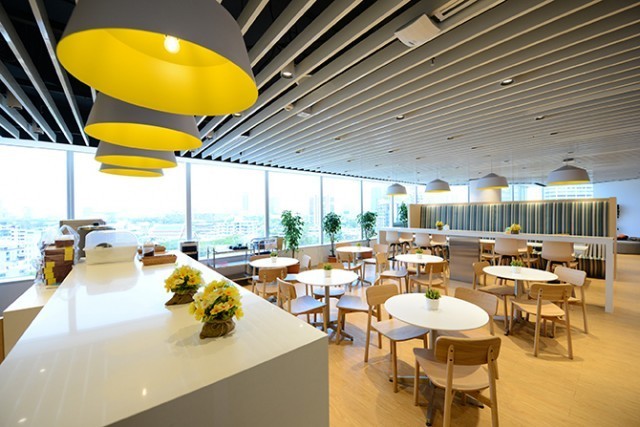
Locate an element on the screen. Image resolution: width=640 pixels, height=427 pixels. potted plants is located at coordinates (214, 309), (180, 277), (516, 270), (518, 228), (442, 223), (438, 296), (424, 251), (333, 271), (276, 259).